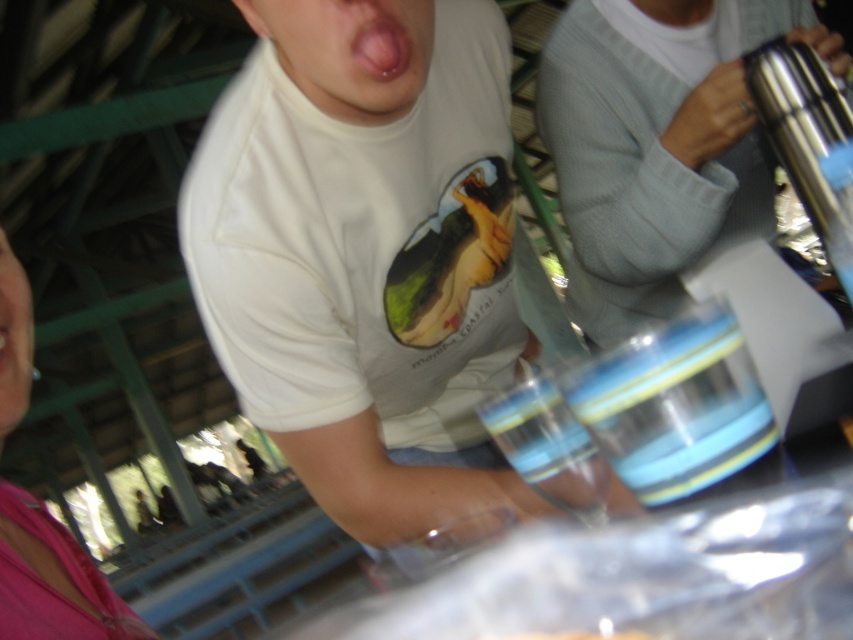
Looking at this image, you are a photographer trying to capture a clear shot of the blue striped glass at center and the pink fabric shirt at lower left. Based on the scene description, which object is positioned to the right of the other?

The blue striped glass at center is positioned on the right side of pink fabric shirt at lower left.